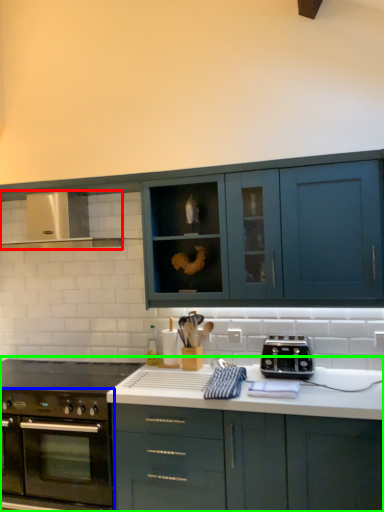
Question: Estimate the real-world distances between objects in this image. Which object is farther from exhaust hood (highlighted by a red box), oven (highlighted by a blue box) or cabinetry (highlighted by a green box)?

Choices:
 (A) oven
 (B) cabinetry

Answer: (B)